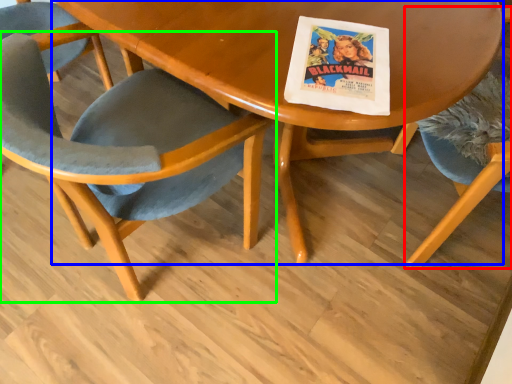
Question: Estimate the real-world distances between objects in this image. Which object is farther from chair (highlighted by a red box), table (highlighted by a blue box) or chair (highlighted by a green box)?

Choices:
 (A) table
 (B) chair

Answer: (B)